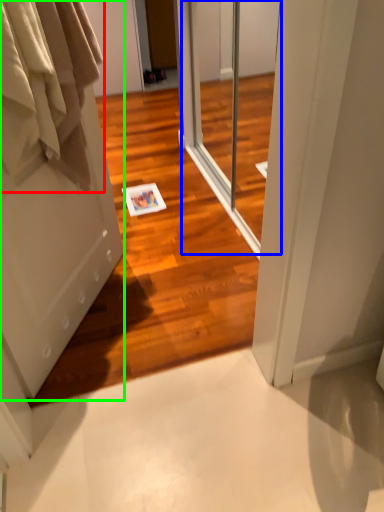
Question: Which object is the farthest from clothing (highlighted by a red box)? Choose among these: screen door (highlighted by a blue box) or door (highlighted by a green box).

Choices:
 (A) screen door
 (B) door

Answer: (A)